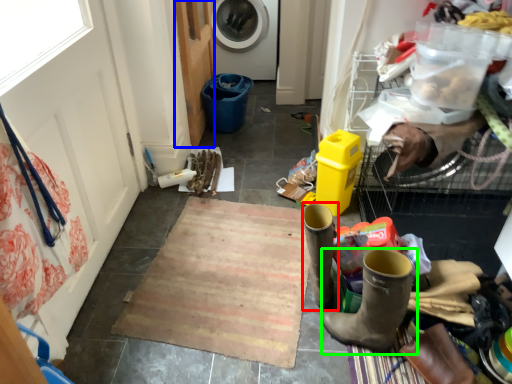
Question: Estimate the real-world distances between objects in this image. Which object is farther from footwear (highlighted by a red box), screen door (highlighted by a blue box) or footwear (highlighted by a green box)?

Choices:
 (A) screen door
 (B) footwear

Answer: (A)